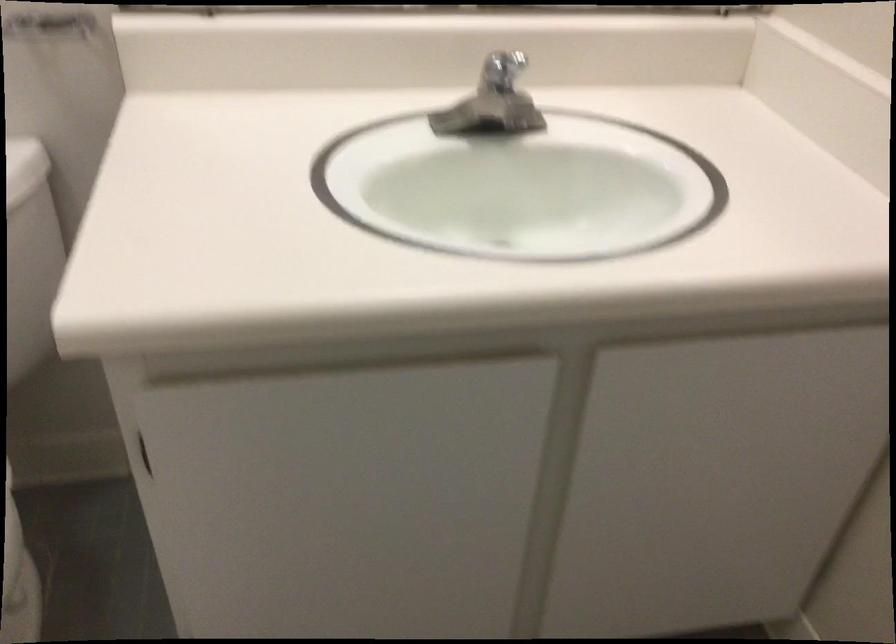
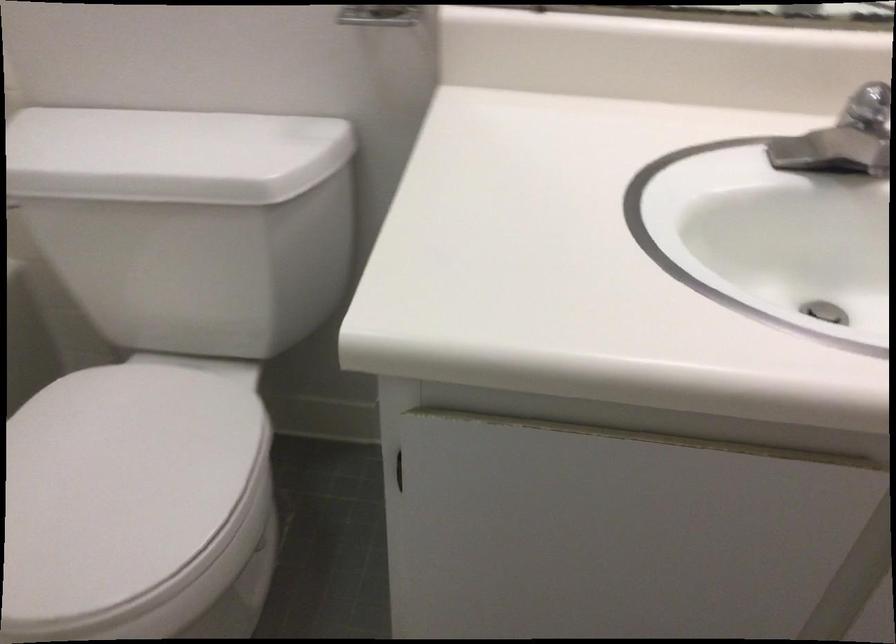
The images are taken continuously from a first-person perspective. In which direction are you moving?

The cameraman moved toward left, forward.